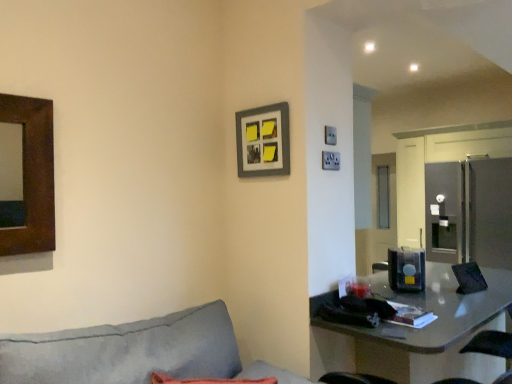
Question: In terms of size, does matte gray picture frame at upper center appear bigger or smaller than translucent plastic container at center?

Choices:
 (A) small
 (B) big

Answer: (A)

Question: Looking at their shapes, would you say matte gray picture frame at upper center is wider or thinner than translucent plastic container at center?

Choices:
 (A) thin
 (B) wide

Answer: (A)

Question: Which object is positioned farthest from the translucent plastic container at center?

Choices:
 (A) matte gray picture frame at upper center
 (B) matte gray table at lower right

Answer: (A)

Question: Considering the real-world distances, which object is closest to the translucent plastic container at center?

Choices:
 (A) matte gray table at lower right
 (B) matte gray picture frame at upper center

Answer: (A)